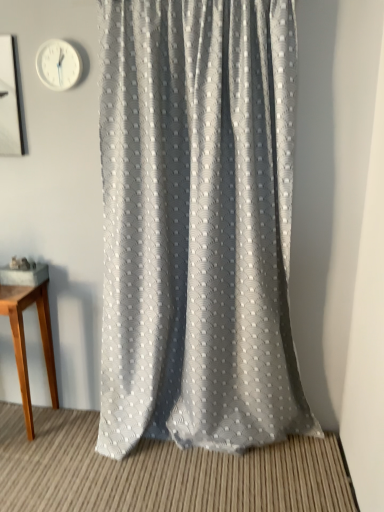
Question: Should I look upward or downward to see light brown wooden table at left?

Choices:
 (A) down
 (B) up

Answer: (A)

Question: From the image's perspective, is textured gray curtain at center under white plastic clock at upper left?

Choices:
 (A) yes
 (B) no

Answer: (A)

Question: Is textured gray curtain at center in front of white plastic clock at upper left?

Choices:
 (A) yes
 (B) no

Answer: (A)

Question: Considering the relative sizes of textured gray curtain at center and white plastic clock at upper left in the image provided, is textured gray curtain at center smaller than white plastic clock at upper left?

Choices:
 (A) no
 (B) yes

Answer: (A)

Question: Can you confirm if textured gray curtain at center is positioned to the right of white plastic clock at upper left?

Choices:
 (A) yes
 (B) no

Answer: (A)

Question: Considering the relative positions of textured gray curtain at center and white plastic clock at upper left in the image provided, is textured gray curtain at center behind white plastic clock at upper left?

Choices:
 (A) yes
 (B) no

Answer: (B)

Question: Is textured gray curtain at center at the left side of white plastic clock at upper left?

Choices:
 (A) no
 (B) yes

Answer: (A)

Question: Is light brown wooden table at left at the back of textured gray curtain at center?

Choices:
 (A) no
 (B) yes

Answer: (A)

Question: Can you confirm if textured gray curtain at center is smaller than light brown wooden table at left?

Choices:
 (A) no
 (B) yes

Answer: (A)

Question: Would you say textured gray curtain at center is a long distance from light brown wooden table at left?

Choices:
 (A) no
 (B) yes

Answer: (A)

Question: Is the position of textured gray curtain at center more distant than that of light brown wooden table at left?

Choices:
 (A) yes
 (B) no

Answer: (B)

Question: From a real-world perspective, is textured gray curtain at center positioned over light brown wooden table at left based on gravity?

Choices:
 (A) yes
 (B) no

Answer: (A)

Question: Does textured gray curtain at center turn towards light brown wooden table at left?

Choices:
 (A) no
 (B) yes

Answer: (A)

Question: Can we say light brown wooden table at left lies outside white plastic clock at upper left?

Choices:
 (A) yes
 (B) no

Answer: (A)